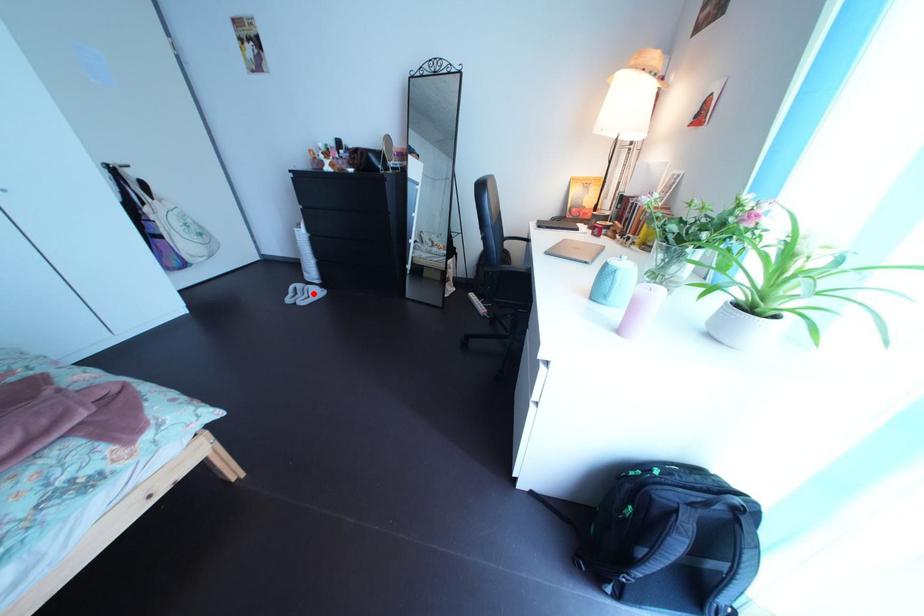
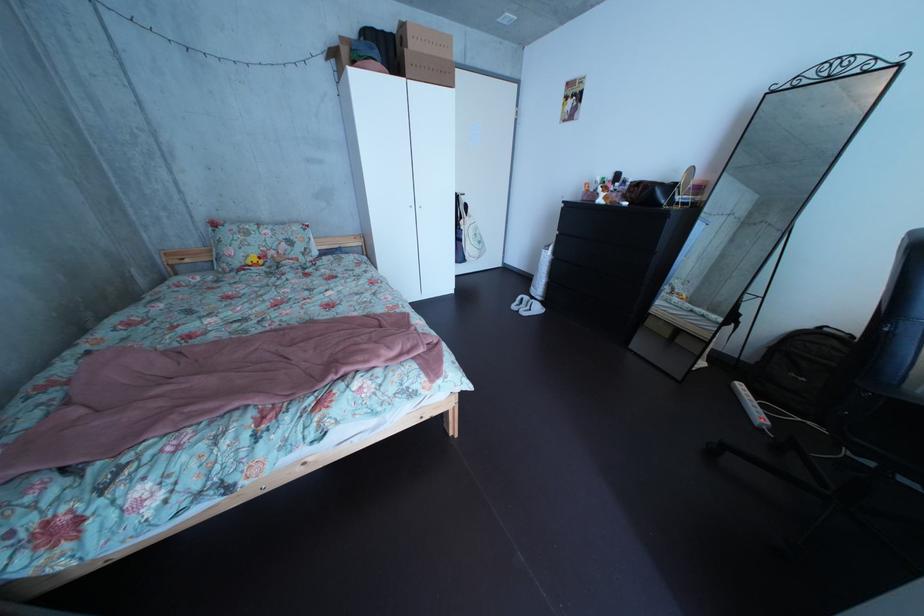
In the second image, find the point that corresponds to the highlighted location in the first image.

(541, 306)